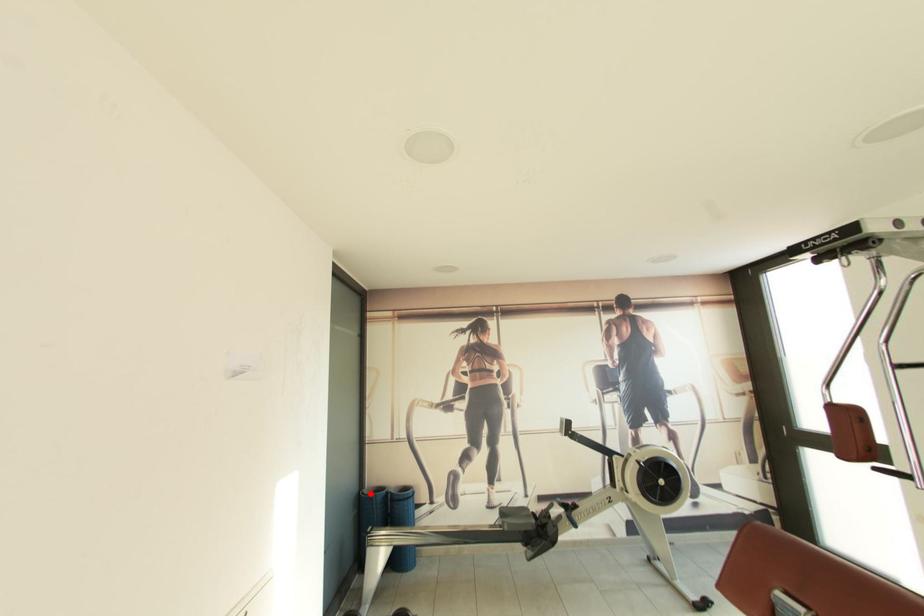
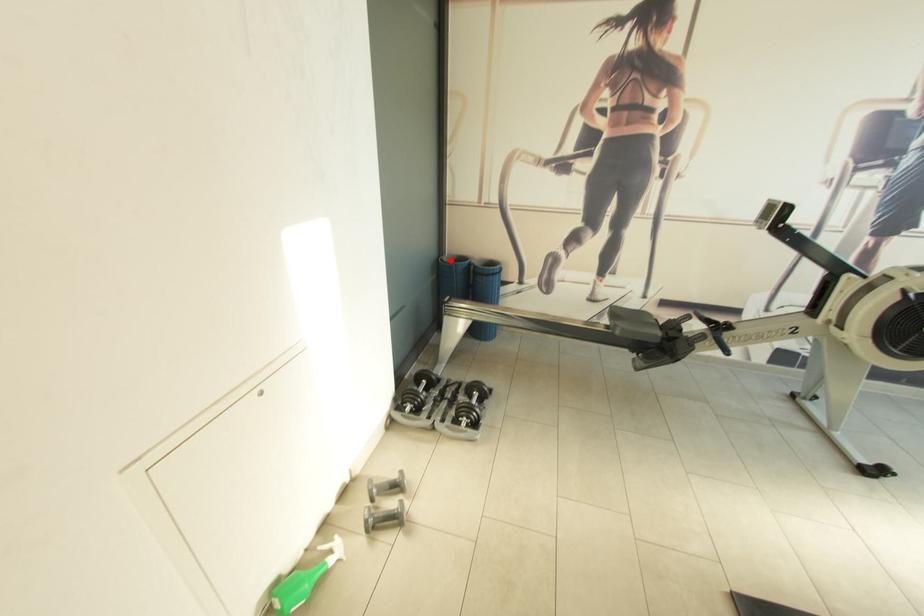
I am providing you with two images of the same scene from different viewpoints. A red point is marked on the first image and another point is marked on the second image. Does the point marked in image1 correspond to the same location as the one in image2?

Yes